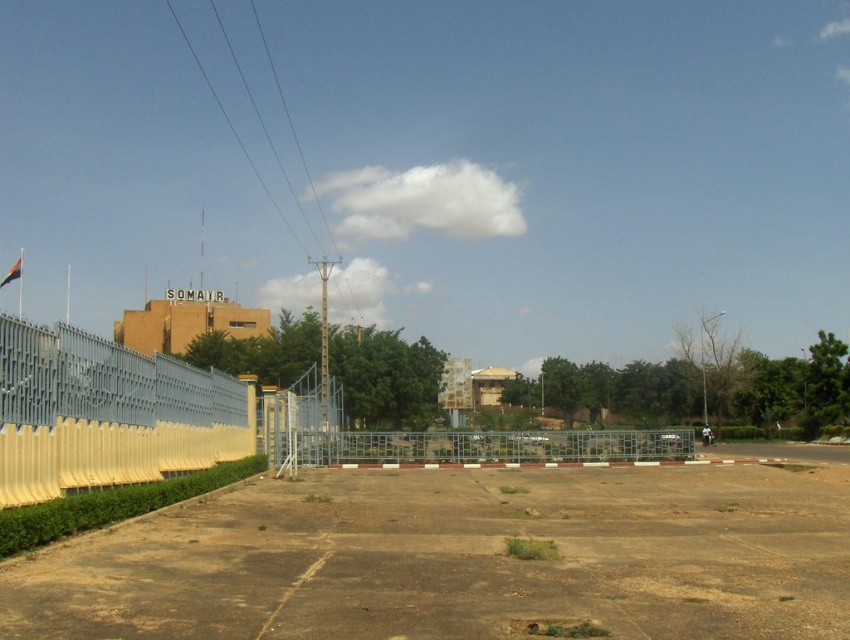
Question: Considering the relative positions of brown dirt field at lower center and metallic silver fence at left in the image provided, where is brown dirt field at lower center located with respect to metallic silver fence at left?

Choices:
 (A) left
 (B) right

Answer: (B)

Question: Among these points, which one is farthest from the camera?

Choices:
 (A) (4, 474)
 (B) (443, 435)
 (C) (663, 568)
 (D) (21, 456)

Answer: (B)

Question: Which object is the closest to the white plastic barrier at left?

Choices:
 (A) metallic grid fence at center
 (B) brown dirt field at lower center

Answer: (B)

Question: Does metallic silver fence at left appear on the right side of white plastic barrier at left?

Choices:
 (A) no
 (B) yes

Answer: (A)

Question: Which point is farther to the camera?

Choices:
 (A) white plastic barrier at left
 (B) brown dirt field at lower center

Answer: (A)

Question: Is metallic silver fence at left above white plastic barrier at left?

Choices:
 (A) no
 (B) yes

Answer: (B)